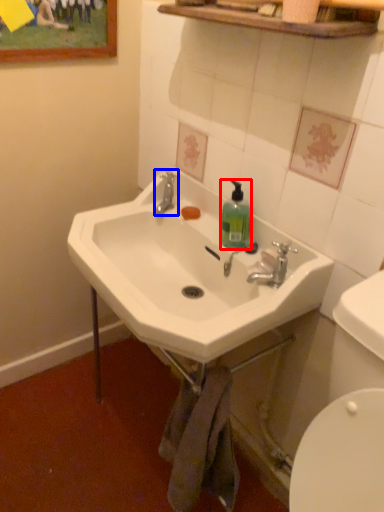
Question: Which object is closer to the camera taking this photo, bottle (highlighted by a red box) or plumbing fixture (highlighted by a blue box)?

Choices:
 (A) bottle
 (B) plumbing fixture

Answer: (A)